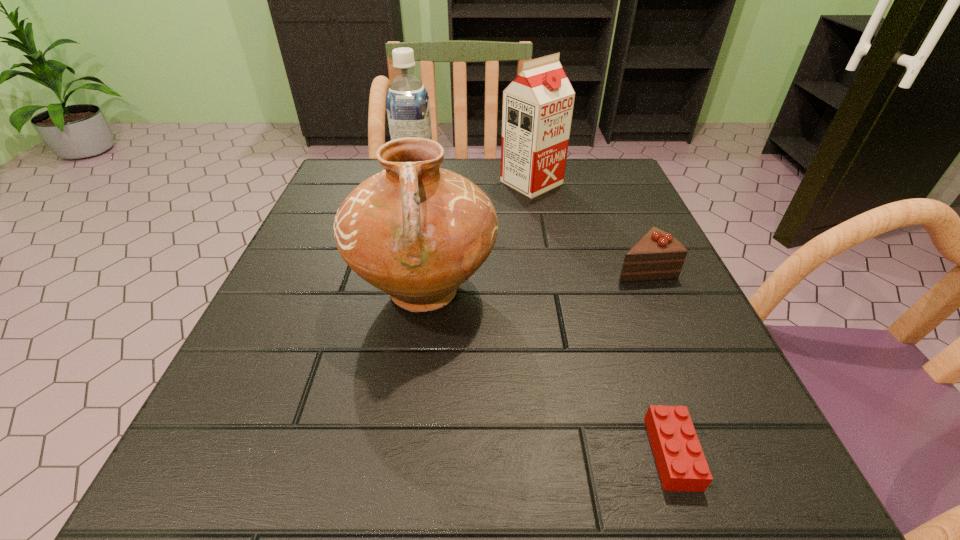
Where is `free location that satisfies the following two spatial constraints: 1. on the front side of the right soya milk; 2. on the right side of the shortest object`? free location that satisfies the following two spatial constraints: 1. on the front side of the right soya milk; 2. on the right side of the shortest object is located at coordinates (580, 453).